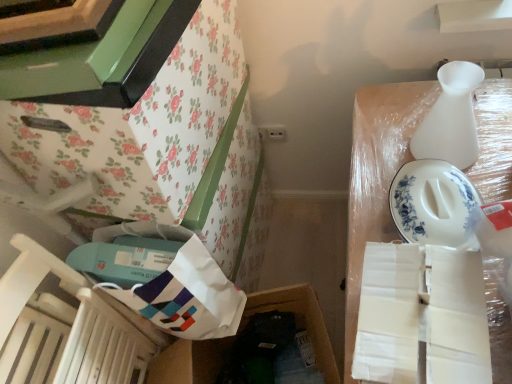
I want to click on empty space that is to the right of white matte vase at upper right, so click(x=492, y=123).